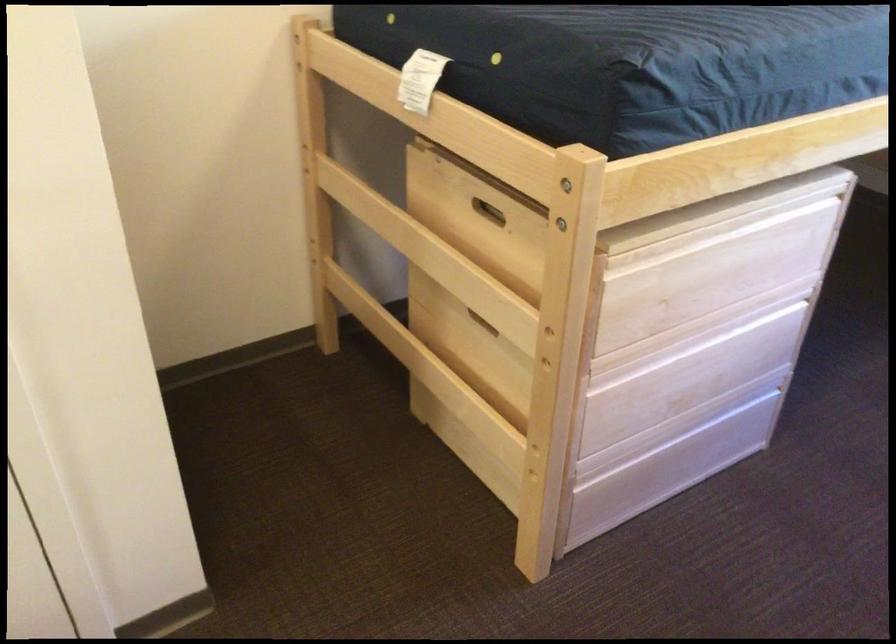
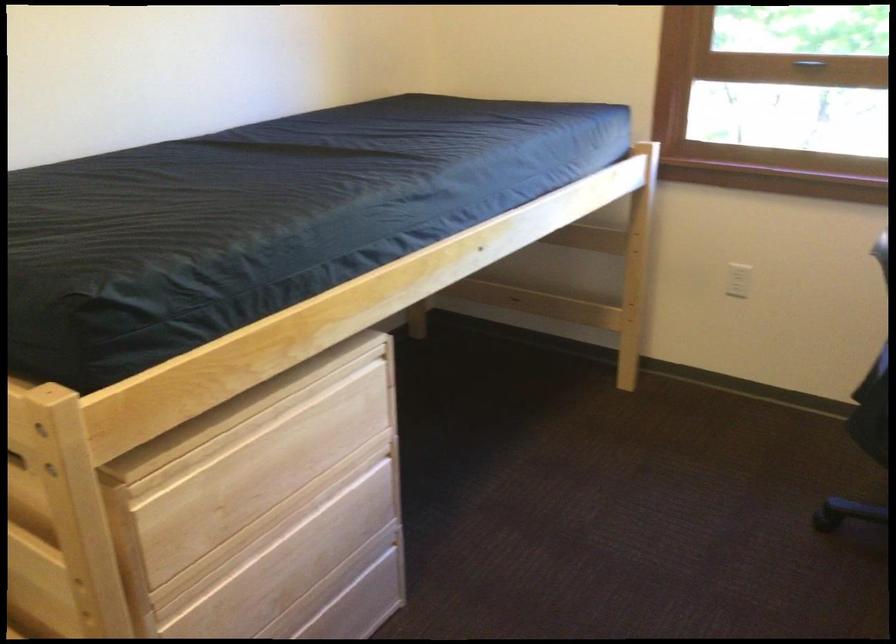
Where in the second image is the point corresponding to pixel 725 437 from the first image?

(354, 611)